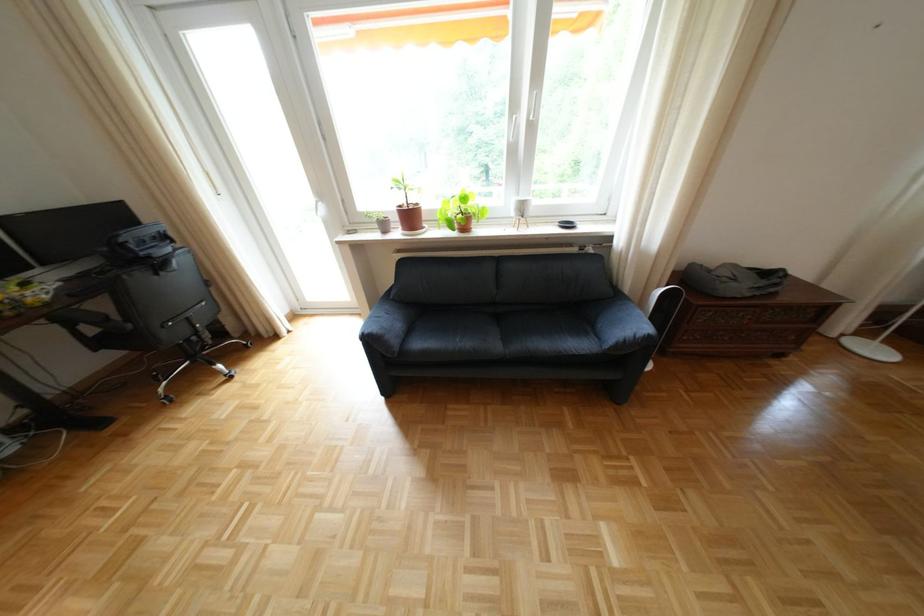
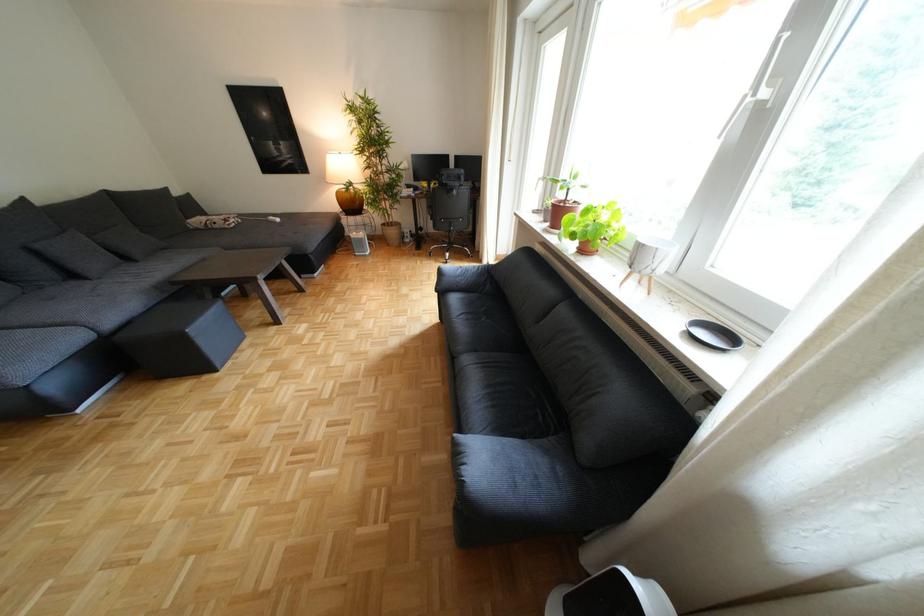
The point at (x=397, y=233) is marked in the first image. Where is the corresponding point in the second image?

(558, 220)